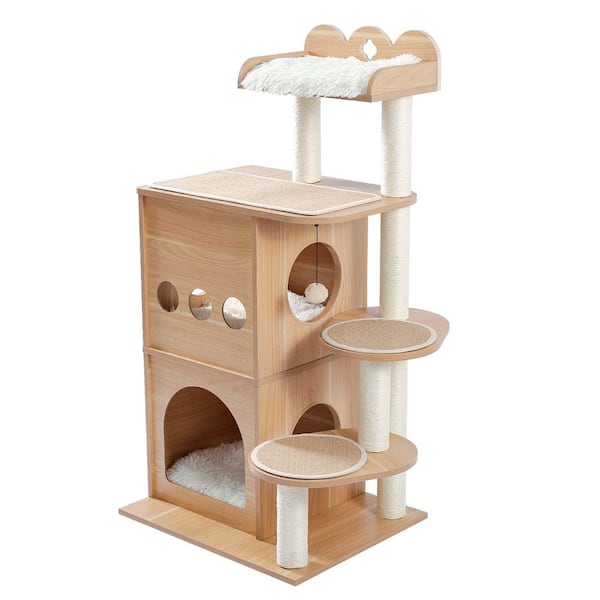
Find the location of a particular element. The height and width of the screenshot is (600, 600). bottom cushion is located at coordinates (223, 467).